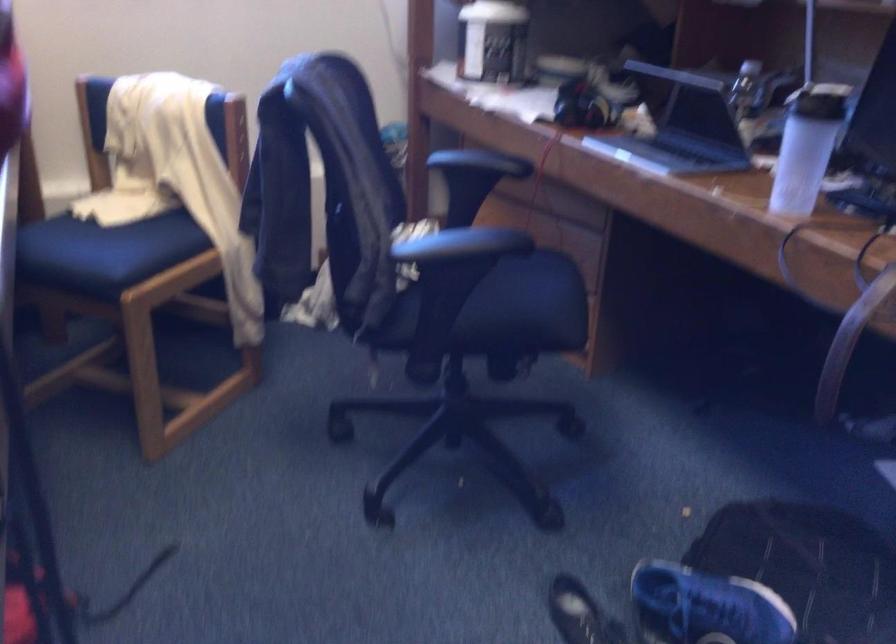
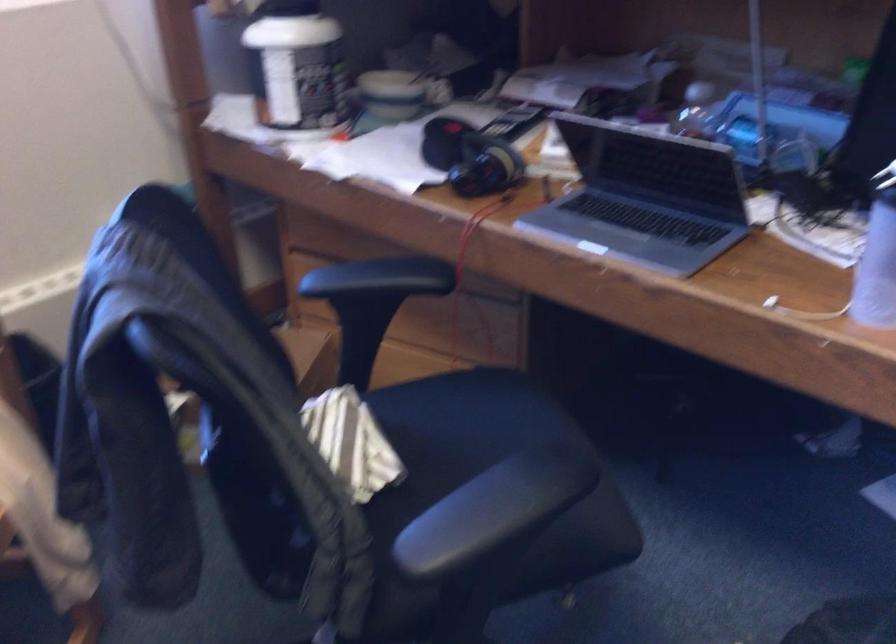
Where in the second image is the point corresponding to [586,106] from the first image?

(470, 158)